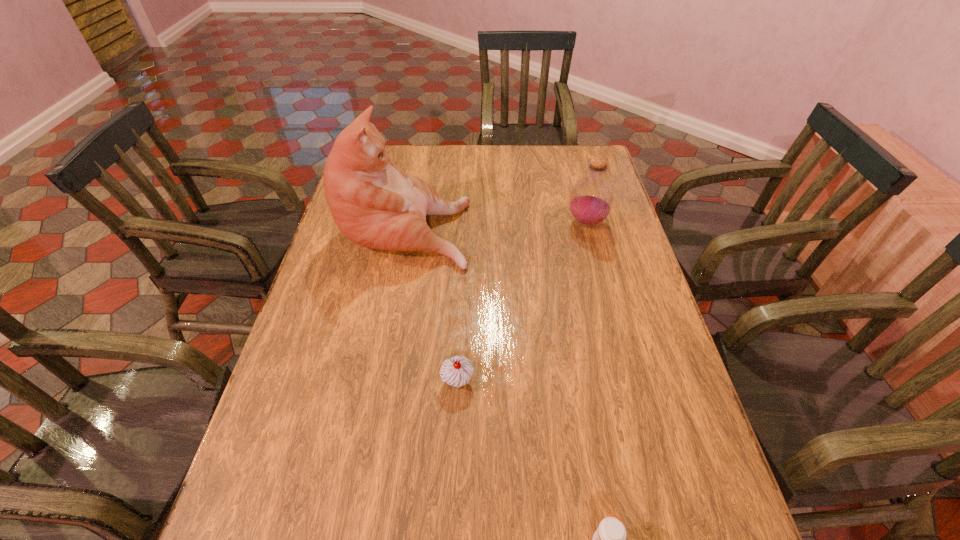
Locate an element on the screen. The height and width of the screenshot is (540, 960). free space that satisfies the following two spatial constraints: 1. on the face of the cat; 2. on the left side of the second shortest object is located at coordinates (377, 381).